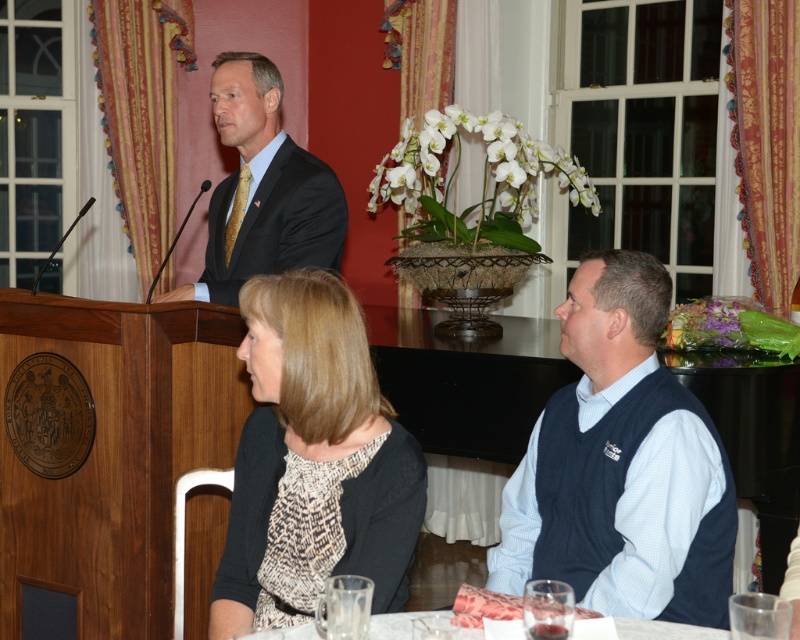
Who is shorter, black knit sweater at lower left or matte black suit at center?

matte black suit at center is shorter.

Which is below, black knit sweater at lower left or matte black suit at center?

black knit sweater at lower left

Who is more distant from viewer, (322, 275) or (208, 285)?

The point (208, 285) is more distant.

Where is `black knit sweater at lower left`? The width and height of the screenshot is (800, 640). black knit sweater at lower left is located at coordinates (314, 461).

Does navy blue sweater vest at right have a greater height compared to black knit sweater at lower left?

Yes.

Between point (609, 467) and point (276, 348), which one is positioned behind?

Positioned behind is point (609, 467).

Is point (702, 451) positioned in front of point (318, 372)?

No, it is behind (318, 372).

What are the coordinates of `navy blue sweater vest at right` in the screenshot? It's located at (621, 465).

Is the position of navy blue sweater vest at right less distant than that of matte black suit at center?

Yes, navy blue sweater vest at right is in front of matte black suit at center.

Where is `navy blue sweater vest at right`? navy blue sweater vest at right is located at coordinates (621, 465).